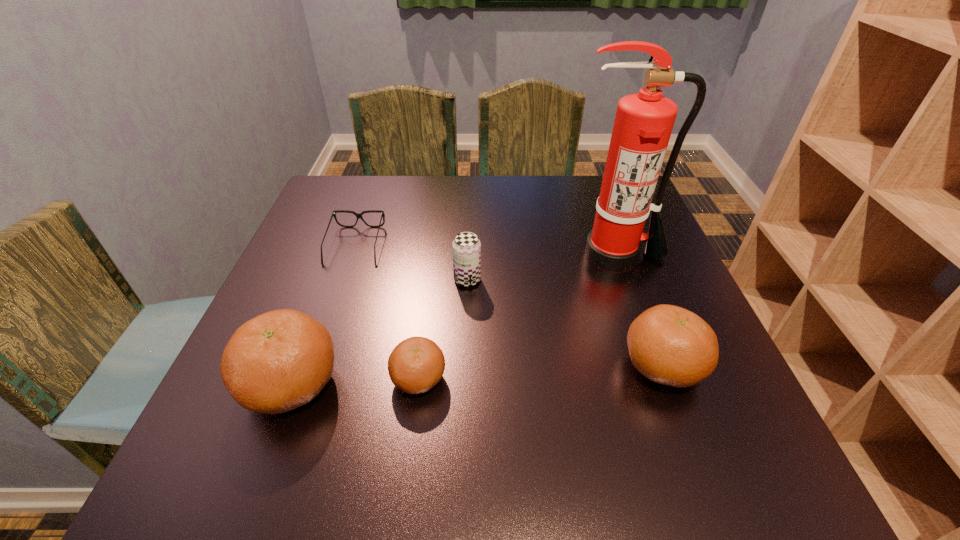
Where is `blank space located 0.080m with the lenses facing outward on the spectacles`? The height and width of the screenshot is (540, 960). blank space located 0.080m with the lenses facing outward on the spectacles is located at coordinates (341, 290).

In order to click on blank area located at the nozzle of the fire extinguisher in this screenshot , I will do `click(640, 325)`.

Where is `vacant space located on the left of the beer can`? This screenshot has width=960, height=540. vacant space located on the left of the beer can is located at coordinates (422, 280).

You are a GUI agent. You are given a task and a screenshot of the screen. Output one action in this format:
    pyautogui.click(x=<x>, y=<y>)
    Task: Click on the clementine present at the left edge
    The height and width of the screenshot is (540, 960).
    Given the screenshot: What is the action you would take?
    pyautogui.click(x=280, y=360)

The image size is (960, 540). Find the location of `spectacles that is at the left edge`. spectacles that is at the left edge is located at coordinates [359, 215].

Where is `clementine that is at the right edge`? clementine that is at the right edge is located at coordinates (669, 345).

Image resolution: width=960 pixels, height=540 pixels. What are the coordinates of `fire extinguisher at the right edge` in the screenshot? It's located at (643, 124).

Image resolution: width=960 pixels, height=540 pixels. In order to click on object that is at the near left corner in this screenshot , I will do `click(280, 360)`.

Identify the location of object that is at the near right corner. (669, 345).

In the image, there is a desktop. Identify the location of vacant space at the far edge. The width and height of the screenshot is (960, 540). (384, 210).